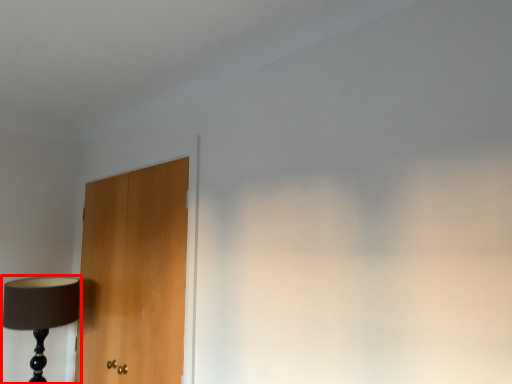
Question: From the image's perspective, where is lamp (annotated by the red box) located relative to door?

Choices:
 (A) below
 (B) above

Answer: (A)